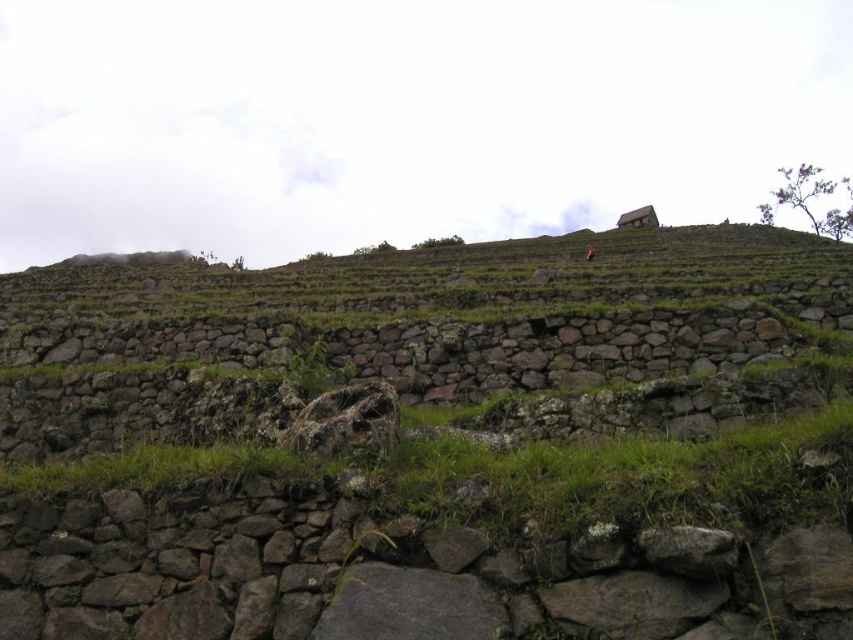
You are standing at the base of the terraced landscape and want to reach the small structure on the highest terrace. Which direction should you move relative to the natural stone terraces at upper center?

You should move towards the natural stone terraces at upper center since they are located at point (442, 452), which is the direction of the highest terrace where the small structure is situated.

You are an archaeologist examining the terraced landscape. You notice the natural stone terraces at upper center and the brown stone figure at upper center. Which of these two objects occupies a greater area in the scene?

The natural stone terraces at upper center has a larger size compared to the brown stone figure at upper center, so it occupies a greater area in the scene.

You are standing at the base of the terraced landscape in the image. You want to reach the small traditional hut at the top. Which direction should you move relative to the point labeled as point (442, 452)? Please answer with either left, right, forward, backward, up, or down.

The point (442, 452) indicates natural stone terraces at upper center. Since the terraces ascend the hillside and the hut is atop the highest terrace, you should move forward towards the point (442, 452) to reach the hut.